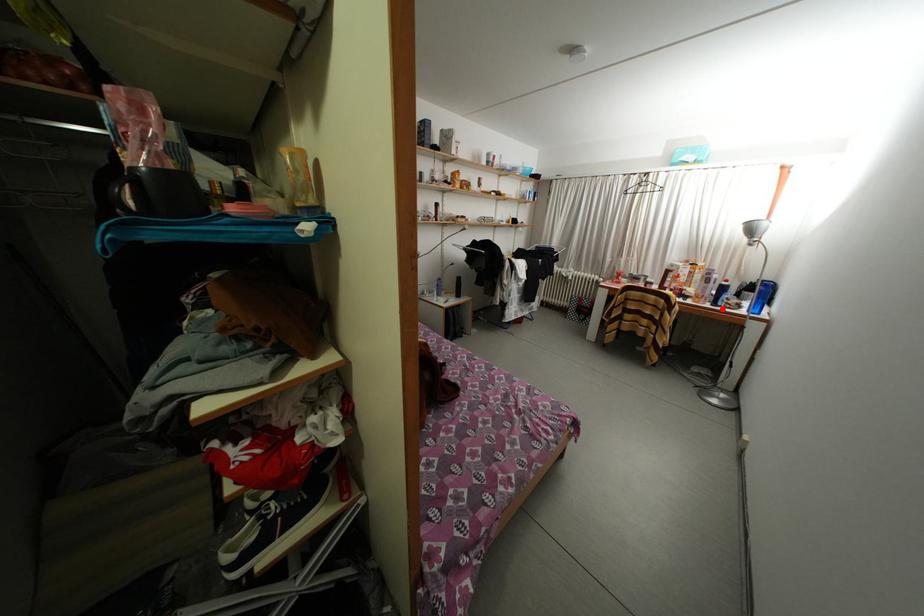
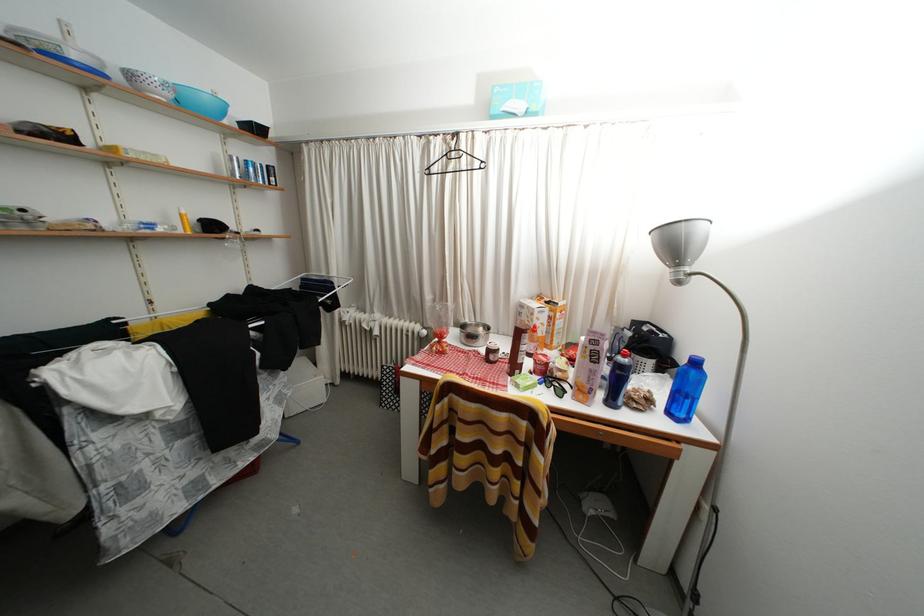
The point at the highlighted location is marked in the first image. Where is the corresponding point in the second image?

(618, 408)